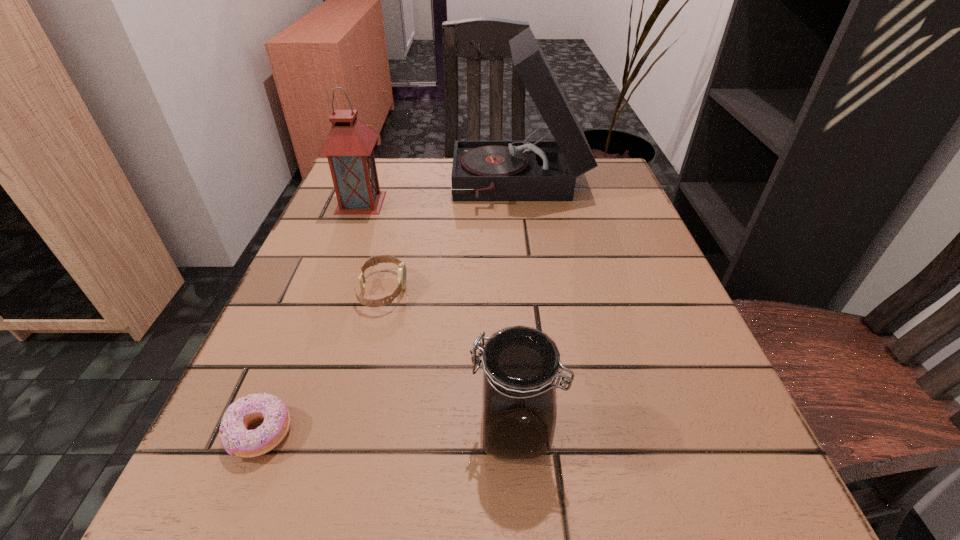
Where is `blank space located on the lid of the jar`? The height and width of the screenshot is (540, 960). blank space located on the lid of the jar is located at coordinates (357, 431).

Locate an element on the screen. This screenshot has height=540, width=960. vacant position located 0.080m on the lid of the jar is located at coordinates (410, 431).

Locate an element on the screen. free spot located 0.180m on the lid of the jar is located at coordinates (334, 431).

Find the location of `vacant space located 0.140m on the face of the third nearest object`. vacant space located 0.140m on the face of the third nearest object is located at coordinates (485, 290).

Find the location of `vacant space located 0.170m on the back of the doughnut`. vacant space located 0.170m on the back of the doughnut is located at coordinates (308, 316).

I want to click on phonograph_record present at the far edge, so click(x=525, y=170).

Locate an element on the screen. lantern present at the far edge is located at coordinates (349, 145).

In order to click on lantern located at the left edge in this screenshot , I will do `click(349, 145)`.

The image size is (960, 540). I want to click on watch present at the left edge, so click(x=374, y=260).

This screenshot has width=960, height=540. Find the location of `doughnut that is at the left edge`. doughnut that is at the left edge is located at coordinates point(236,439).